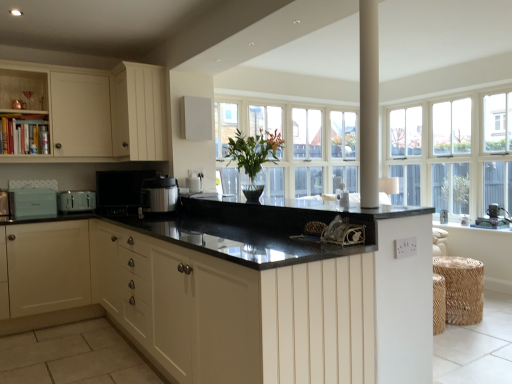
At what (x,y) coordinates should I click in order to perform the action: click on vacant point above black matte microwave at center, placed as the 3th appliance when sorted from left to right (from a real-world perspective). Please return your answer as a coordinate pair (x, y). The image size is (512, 384). Looking at the image, I should click on (125, 173).